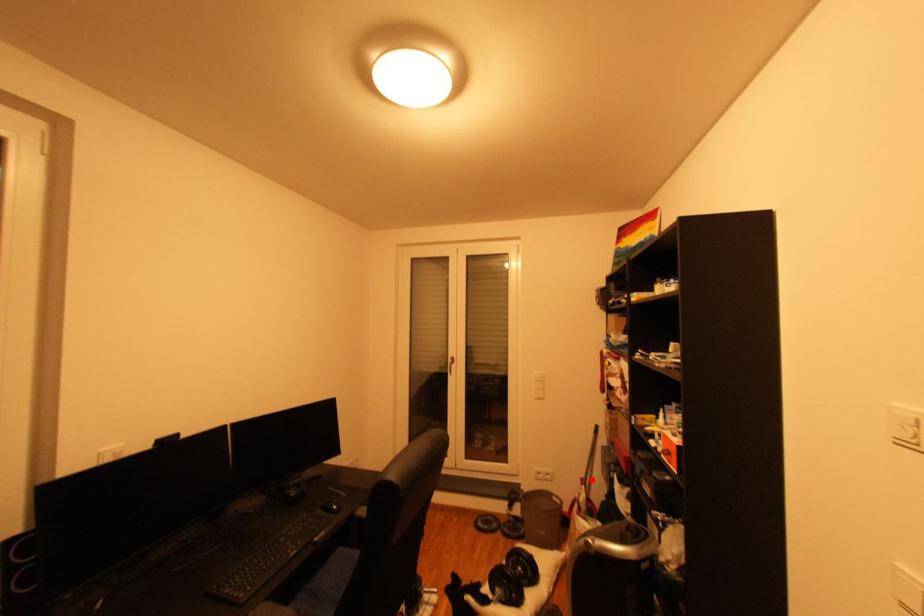
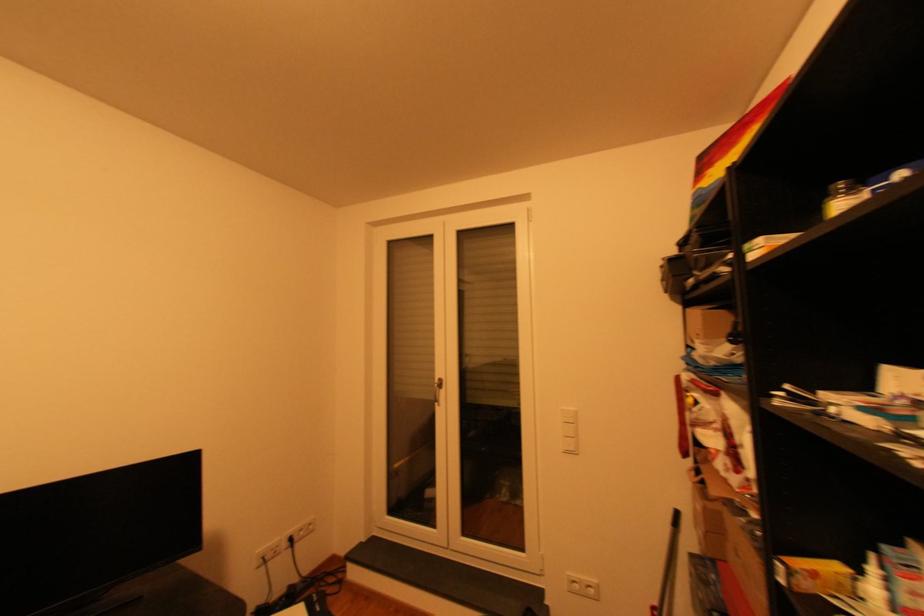
Question: A red point is marked in image1. In image2, is the corresponding 3D point closer to the camera or farther? Reply with the corresponding letter.

Choices:
 (A) The corresponding 3D point is closer.
 (B) The corresponding 3D point is farther.

Answer: (A)